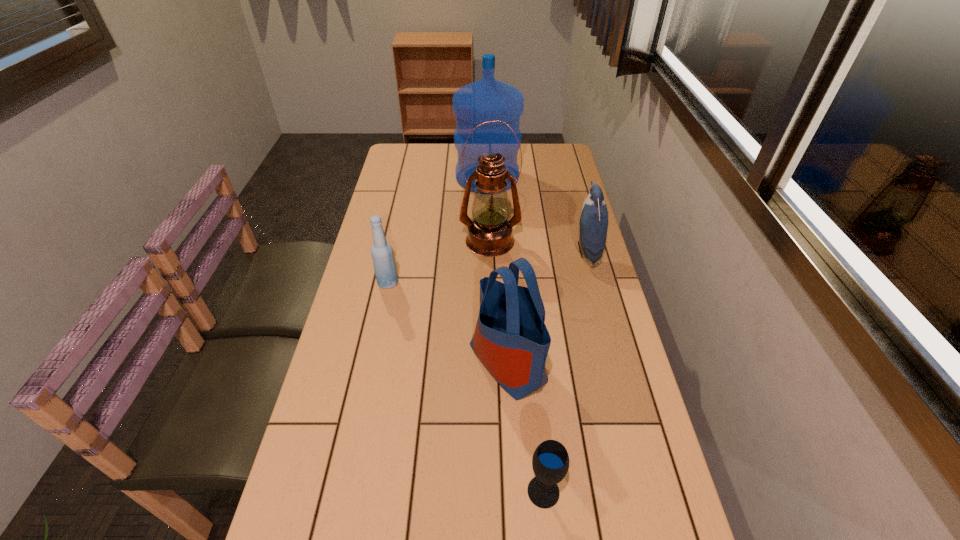
You are a GUI agent. You are given a task and a screenshot of the screen. Output one action in this format:
    pyautogui.click(x=<x>, y=<y>)
    Task: Click on the farthest object
    This screenshot has width=960, height=540.
    Given the screenshot: What is the action you would take?
    pyautogui.click(x=488, y=99)

Locate an element on the screen. The width and height of the screenshot is (960, 540). oil lamp is located at coordinates (489, 232).

Where is `handbag`? This screenshot has width=960, height=540. handbag is located at coordinates (511, 339).

This screenshot has height=540, width=960. I want to click on the third tallest object, so click(x=511, y=339).

Where is `the third nearest object`? This screenshot has height=540, width=960. the third nearest object is located at coordinates (384, 264).

You are a GUI agent. You are given a task and a screenshot of the screen. Output one action in this format:
    pyautogui.click(x=<x>, y=<y>)
    Task: Click on the bottle
    The height and width of the screenshot is (540, 960).
    Given the screenshot: What is the action you would take?
    pyautogui.click(x=384, y=264)

Identify the location of the rightmost object. (593, 220).

This screenshot has width=960, height=540. Identify the location of wineglass. (550, 462).

The width and height of the screenshot is (960, 540). I want to click on the shortest object, so click(x=550, y=462).

Where is `vacant region located on the left of the farthest object`? vacant region located on the left of the farthest object is located at coordinates (420, 177).